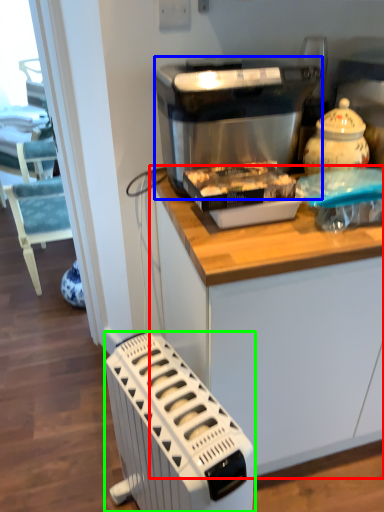
Question: Estimate the real-world distances between objects in this image. Which object is farther from cabinetry (highlighted by a red box), kitchen appliance (highlighted by a blue box) or home appliance (highlighted by a green box)?

Choices:
 (A) kitchen appliance
 (B) home appliance

Answer: (A)